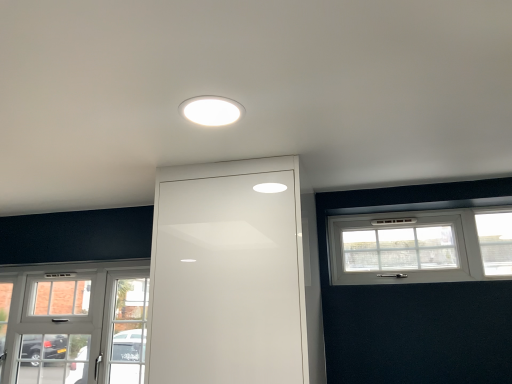
Question: Does white textured window at upper right, the second window in the bottom-to-top sequence, appear on the right side of white glossy door at center?

Choices:
 (A) yes
 (B) no

Answer: (A)

Question: Is the surface of white textured window at upper right, placed as the 1th window when sorted from front to back, in direct contact with white glossy door at center?

Choices:
 (A) no
 (B) yes

Answer: (A)

Question: Is white textured window at upper right, placed as the 1th window when sorted from front to back, not near white glossy door at center?

Choices:
 (A) no
 (B) yes

Answer: (A)

Question: From a real-world perspective, does white textured window at upper right, placed as the 1th window when sorted from front to back, stand above white glossy door at center?

Choices:
 (A) yes
 (B) no

Answer: (A)

Question: From the image's perspective, is white textured window at upper right, marked as the 2th window in a left-to-right arrangement, located beneath white glossy door at center?

Choices:
 (A) no
 (B) yes

Answer: (A)

Question: Can you confirm if white textured window at upper right, marked as the 2th window in a left-to-right arrangement, is smaller than white glossy door at center?

Choices:
 (A) no
 (B) yes

Answer: (B)

Question: From a real-world perspective, is white textured window at upper right, which ranks as the first window in right-to-left order, beneath white glossy light fixture at center?

Choices:
 (A) no
 (B) yes

Answer: (B)

Question: Is white glossy light fixture at center completely or partially inside white textured window at upper right, placed as the 1th window when sorted from front to back?

Choices:
 (A) no
 (B) yes

Answer: (A)

Question: Is white textured window at upper right, positioned as the 1th window in top-to-bottom order, oriented away from white glossy light fixture at center?

Choices:
 (A) yes
 (B) no

Answer: (B)

Question: Is white textured window at upper right, arranged as the second window when viewed from the back, aimed at white glossy light fixture at center?

Choices:
 (A) yes
 (B) no

Answer: (A)

Question: From the image's perspective, does white textured window at upper right, positioned as the 1th window in top-to-bottom order, appear higher than white glossy light fixture at center?

Choices:
 (A) no
 (B) yes

Answer: (A)

Question: Is white textured window at upper right, the second window in the bottom-to-top sequence, positioned behind white glossy light fixture at center?

Choices:
 (A) no
 (B) yes

Answer: (B)

Question: Is white glossy door at center closer to camera compared to white glossy light fixture at center?

Choices:
 (A) yes
 (B) no

Answer: (B)